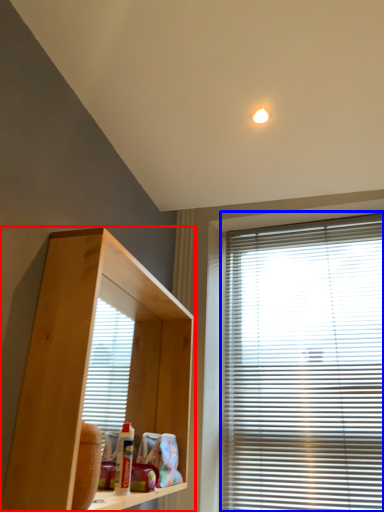
Question: Which point is closer to the camera, shelf (highlighted by a red box) or window blind (highlighted by a blue box)?

Choices:
 (A) shelf
 (B) window blind

Answer: (A)